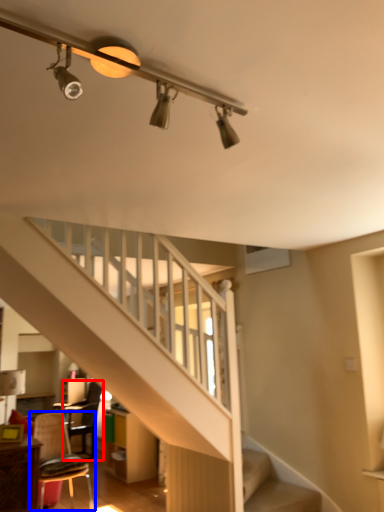
Question: Which point is further to the camera, chair (highlighted by a red box) or chair (highlighted by a blue box)?

Choices:
 (A) chair
 (B) chair

Answer: (A)